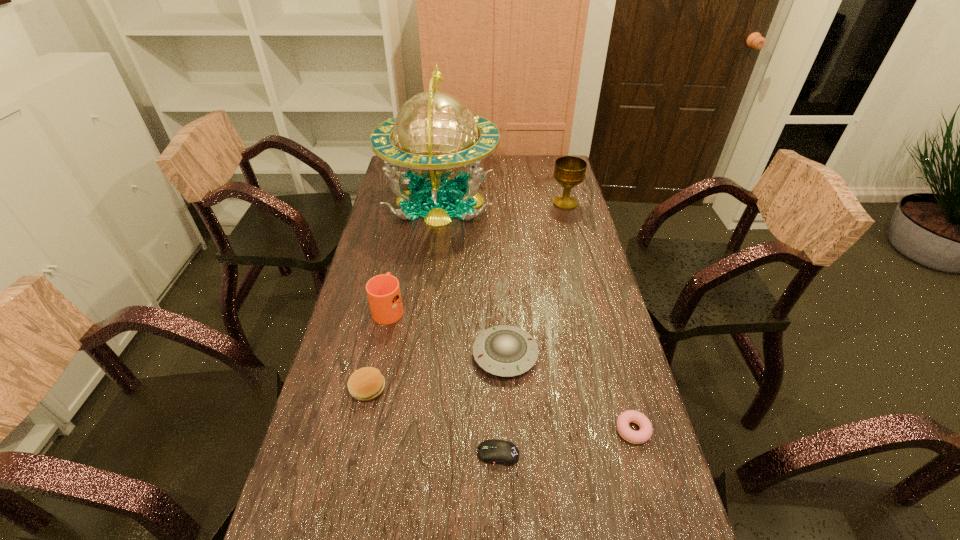
Find the location of a particular element. The width and height of the screenshot is (960, 540). the tallest object is located at coordinates (435, 134).

Identify the location of the second tallest object. The height and width of the screenshot is (540, 960). pos(569,172).

Find the location of a particular element. the third tallest object is located at coordinates (383, 291).

Locate an element on the screen. the fifth nearest object is located at coordinates (383, 291).

Locate an element on the screen. Image resolution: width=960 pixels, height=540 pixels. saucer is located at coordinates (504, 350).

Find the location of `patty`. patty is located at coordinates (365, 384).

Where is `doughnut`? The height and width of the screenshot is (540, 960). doughnut is located at coordinates (645, 432).

Locate an element on the screen. computer equipment is located at coordinates (492, 451).

The width and height of the screenshot is (960, 540). Identify the location of free space located on the front of the tallest object. (428, 298).

This screenshot has height=540, width=960. In order to click on vacant region located 0.150m on the back of the chalice in this screenshot , I will do `click(559, 177)`.